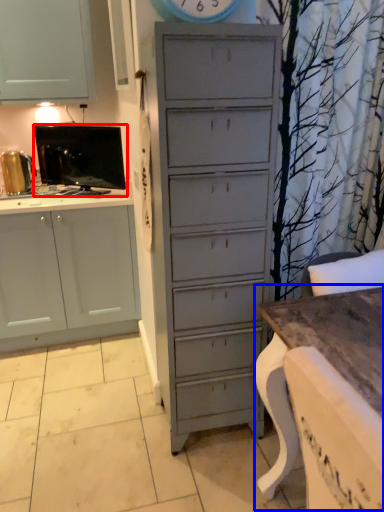
Question: Which object appears closest to the camera in this image, appliance (highlighted by a red box) or table (highlighted by a blue box)?

Choices:
 (A) appliance
 (B) table

Answer: (B)